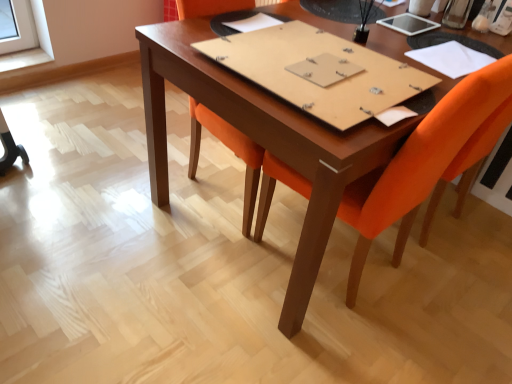
You are a GUI agent. You are given a task and a screenshot of the screen. Output one action in this format:
    pyautogui.click(x=<x>, y=<y>)
    Task: Click on the vacant area that is in front of white paper at center, the third notebook viewed from the right
    
    Given the screenshot: What is the action you would take?
    pyautogui.click(x=252, y=41)